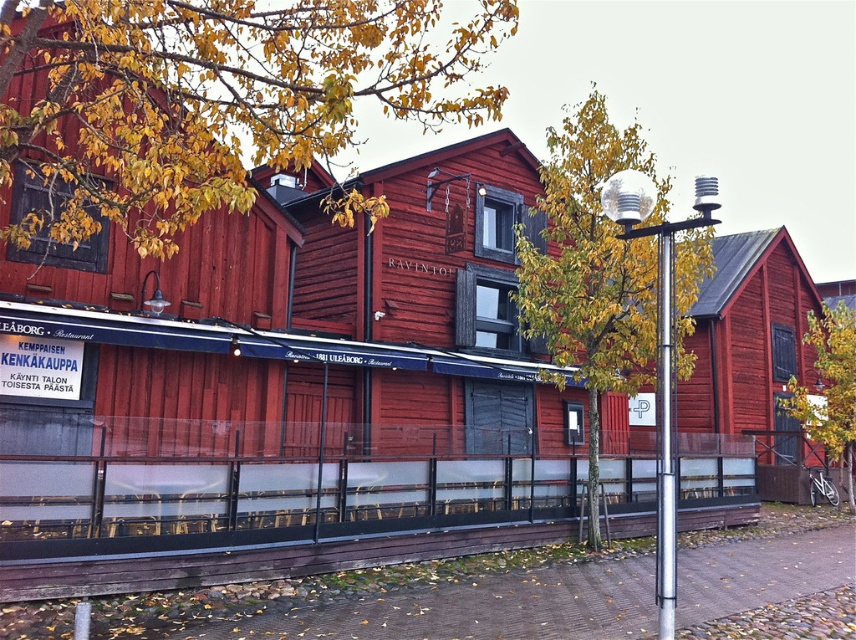
You are a customer looking to sit at the outdoor seating area in front of the red wooden building. You see two metallic poles, the silver metallic pole at center and the metallic pole at right. Which pole is bigger?

The silver metallic pole at center is larger in size than the metallic pole at right.